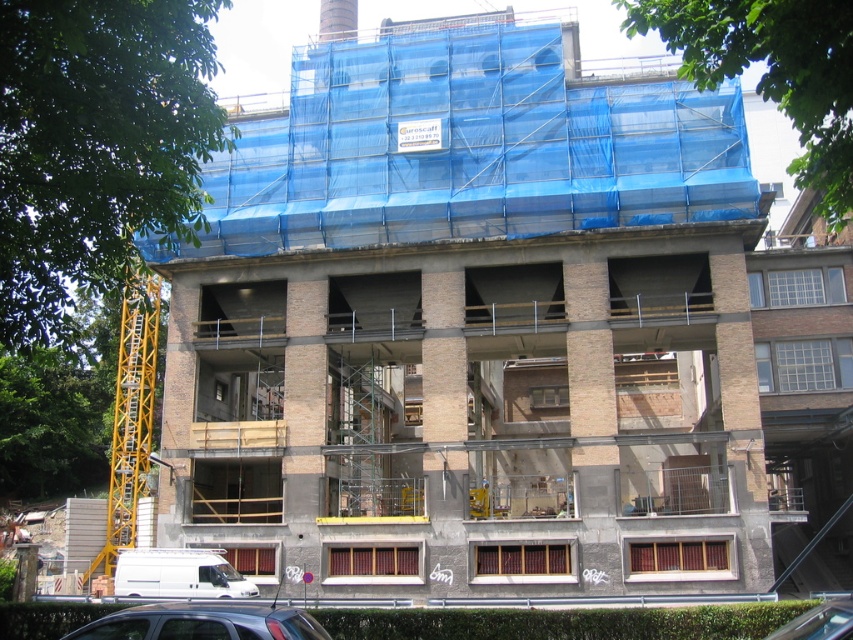
Question: Is white matte van at lower left positioned at the back of metallic silver car at lower right?

Choices:
 (A) yes
 (B) no

Answer: (A)

Question: Which point appears farthest from the camera in this image?

Choices:
 (A) (148, 595)
 (B) (251, 632)

Answer: (A)

Question: Does white matte van at lower left appear on the right side of metallic silver car at lower right?

Choices:
 (A) no
 (B) yes

Answer: (A)

Question: Which of the following is the farthest from the observer?

Choices:
 (A) (236, 621)
 (B) (808, 611)

Answer: (B)

Question: Which point is farther from the camera taking this photo?

Choices:
 (A) (144, 561)
 (B) (802, 625)
 (C) (316, 628)

Answer: (A)

Question: Is matte black car at lower center in front of white matte van at lower left?

Choices:
 (A) no
 (B) yes

Answer: (B)